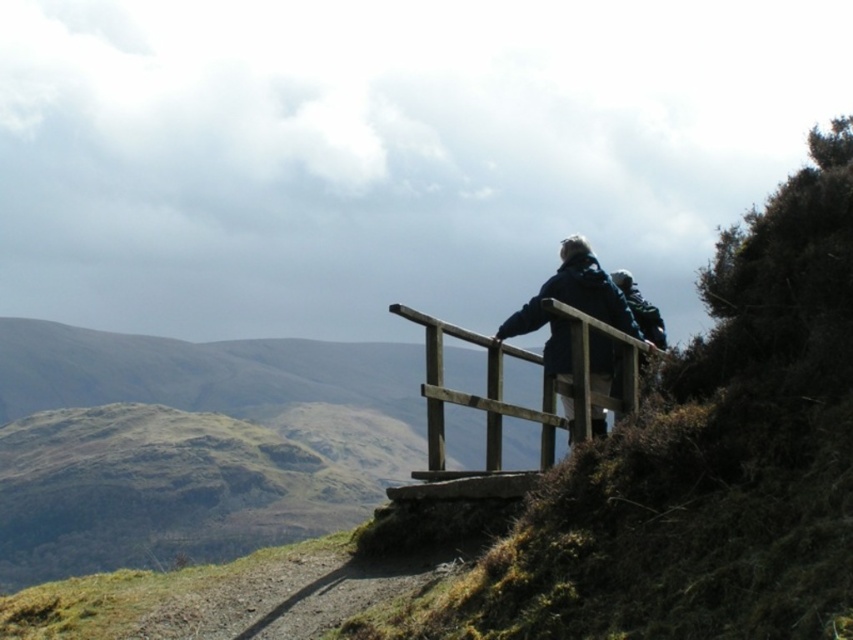
Does wooden rail at upper center appear over dark blue jacket at upper center?

Incorrect, wooden rail at upper center is not positioned above dark blue jacket at upper center.

Between wooden rail at upper center and dark blue jacket at upper center, which one is positioned higher?

dark blue jacket at upper center

At what (x,y) coordinates should I click in order to perform the action: click on wooden rail at upper center. Please return your answer as a coordinate pair (x, y). Looking at the image, I should click on (502, 388).